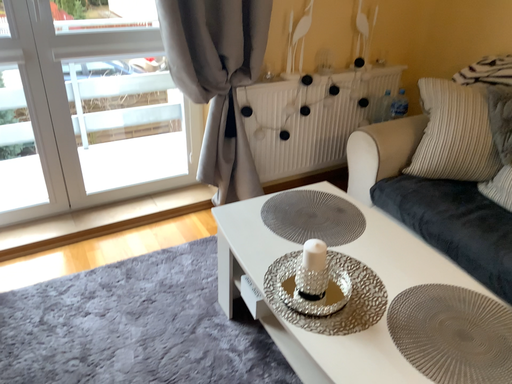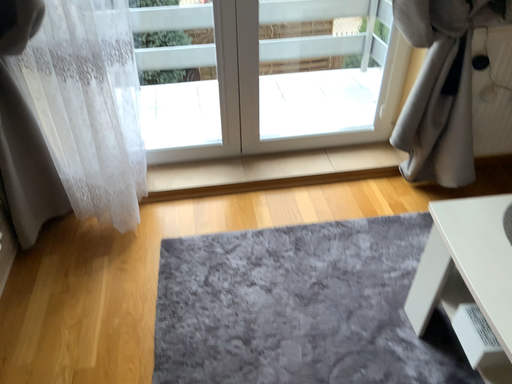
Question: Which way did the camera rotate in the video?

Choices:
 (A) rotated upward
 (B) rotated downward

Answer: (B)